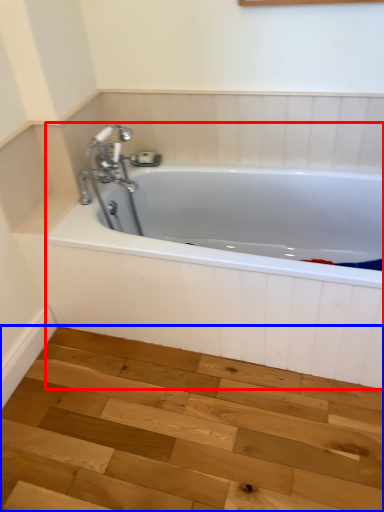
Question: Which object appears closest to the camera in this image, bathtub (highlighted by a red box) or stair (highlighted by a blue box)?

Choices:
 (A) bathtub
 (B) stair

Answer: (B)